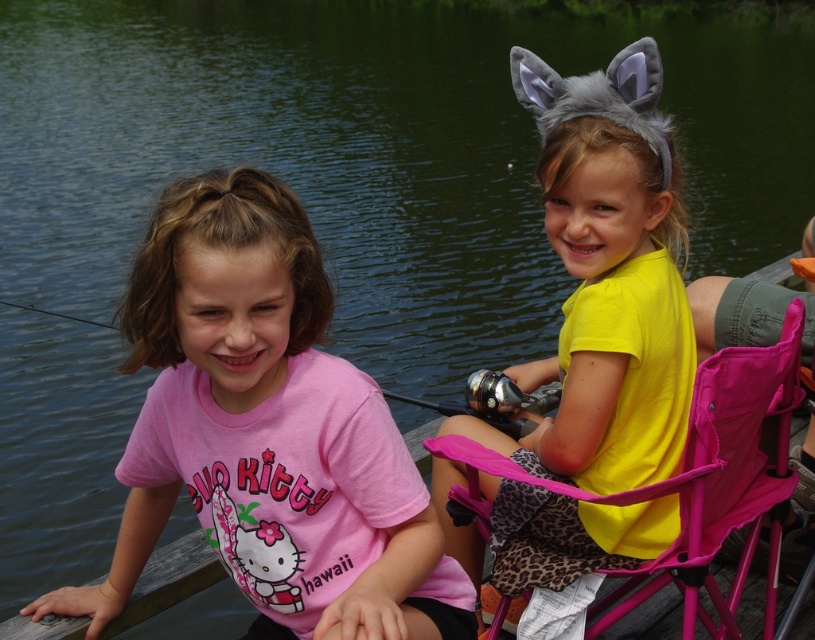
Is yellow matte shirt at center thinner than pink fabric chair at right?

Yes, yellow matte shirt at center is thinner than pink fabric chair at right.

The image size is (815, 640). Describe the element at coordinates (606, 276) in the screenshot. I see `yellow matte shirt at center` at that location.

The image size is (815, 640). What do you see at coordinates (606, 276) in the screenshot?
I see `yellow matte shirt at center` at bounding box center [606, 276].

In order to click on yellow matte shirt at center in this screenshot , I will do `click(606, 276)`.

Which is behind, point (150, 284) or point (673, 212)?

The point (673, 212) is more distant.

Does pink matte shirt at left appear over yellow matte shirt at center?

No.

The image size is (815, 640). Describe the element at coordinates (267, 432) in the screenshot. I see `pink matte shirt at left` at that location.

Where is `pink matte shirt at left`? pink matte shirt at left is located at coordinates (267, 432).

How far apart are pink matte shirt at left and pink fabric chair at right?

pink matte shirt at left is 22.58 inches from pink fabric chair at right.

Between pink matte shirt at left and pink fabric chair at right, which one appears on the right side from the viewer's perspective?

From the viewer's perspective, pink fabric chair at right appears more on the right side.

Does point (391, 520) come behind point (695, 548)?

That is False.

Find the location of a particular element. The image size is (815, 640). pink matte shirt at left is located at coordinates (267, 432).